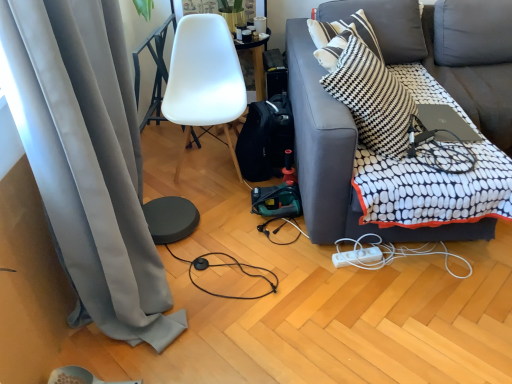
At what (x,y) coordinates should I click in order to perform the action: click on vacant area that lies between gray fabric curtain at left and white plastic power strip at lower right. Please return your answer as a coordinate pair (x, y). The width and height of the screenshot is (512, 384). Looking at the image, I should click on (300, 312).